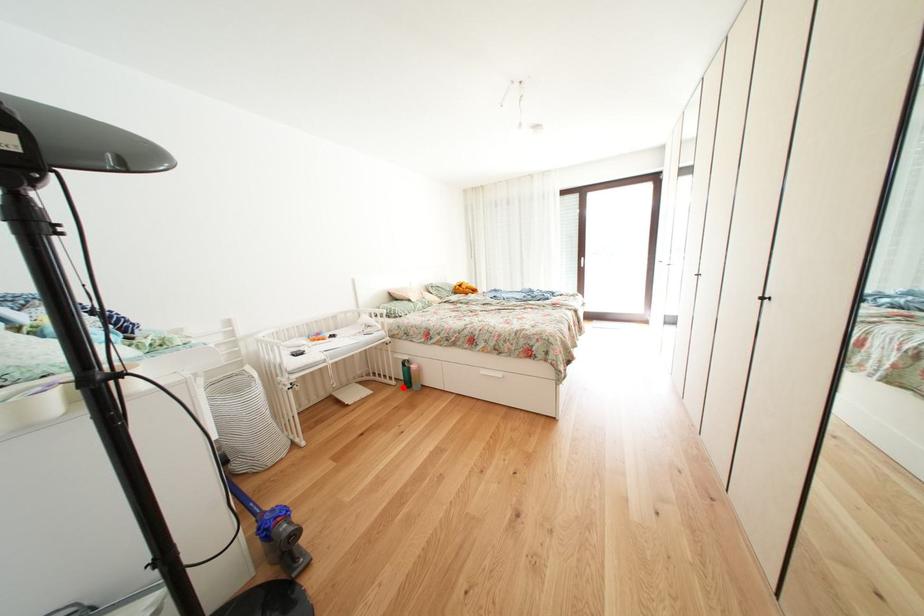
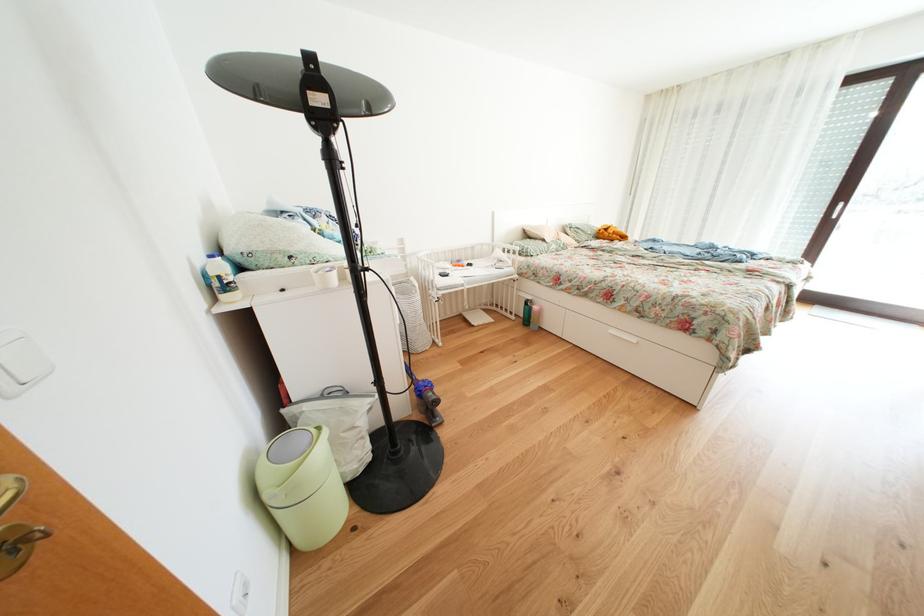
Question: I am providing you with two images of the same scene from different viewpoints. In image1, a red point is highlighted. Considering the same 3D point in image2, which of the following is correct?

Choices:
 (A) It is closer
 (B) It is farther

Answer: (A)